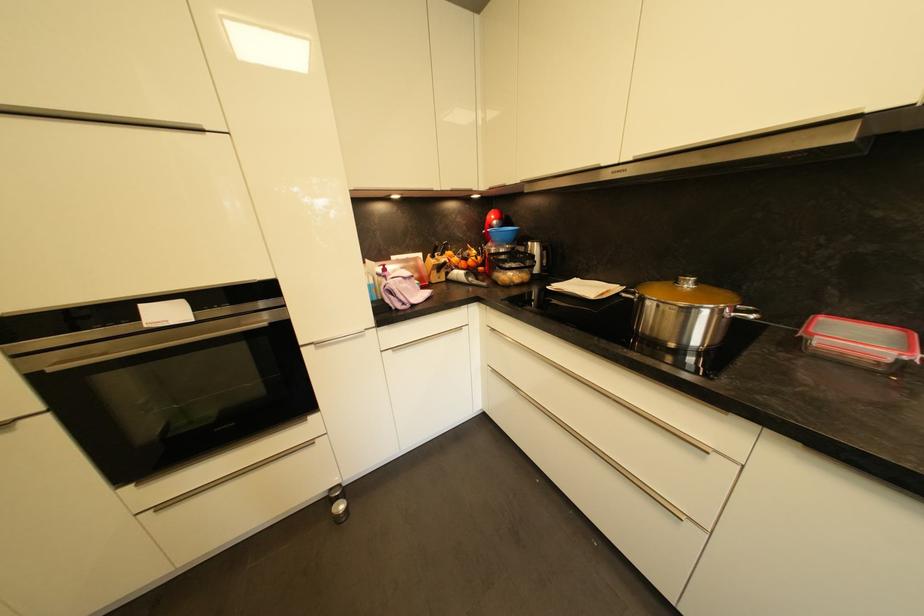
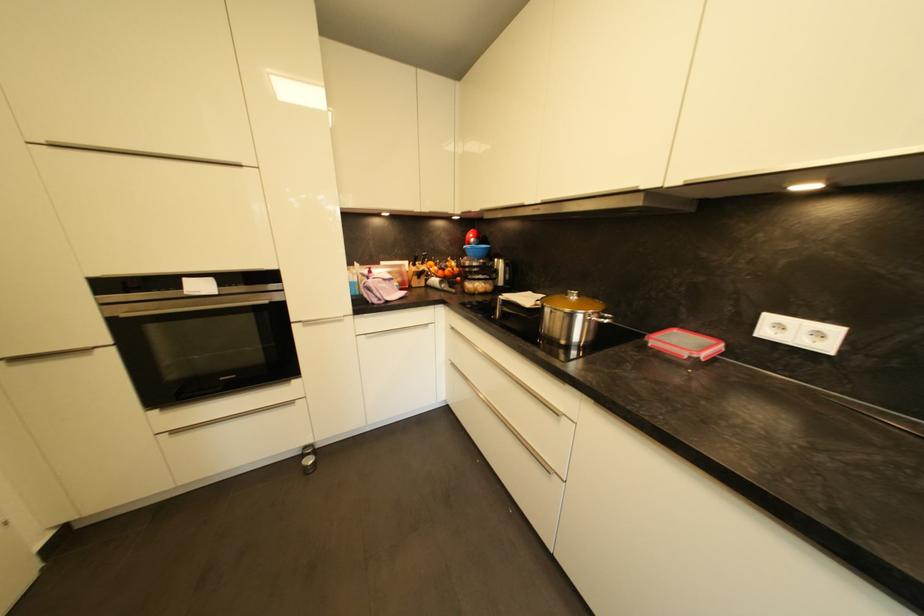
Locate, in the second image, the point that corresponds to the point at 345,509 in the first image.

(313, 463)